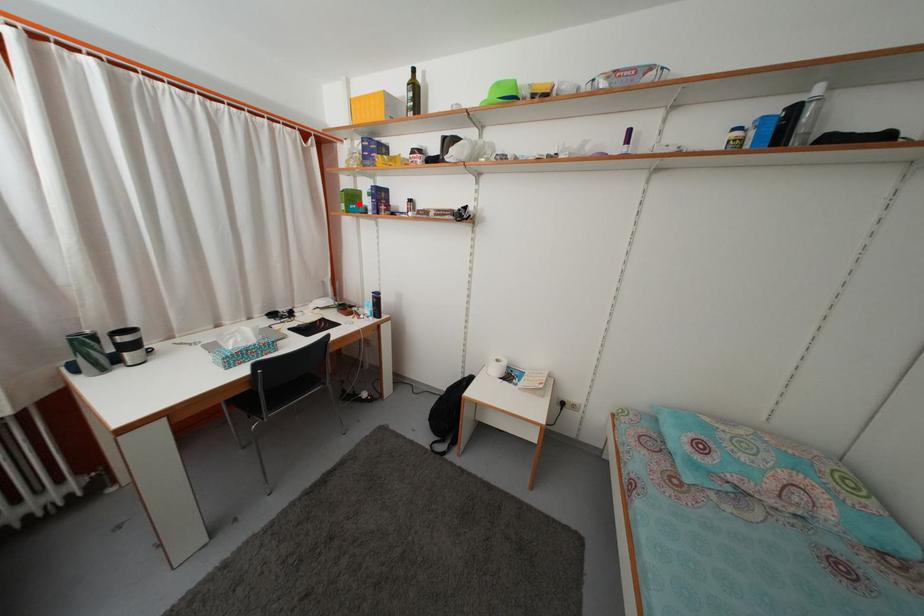
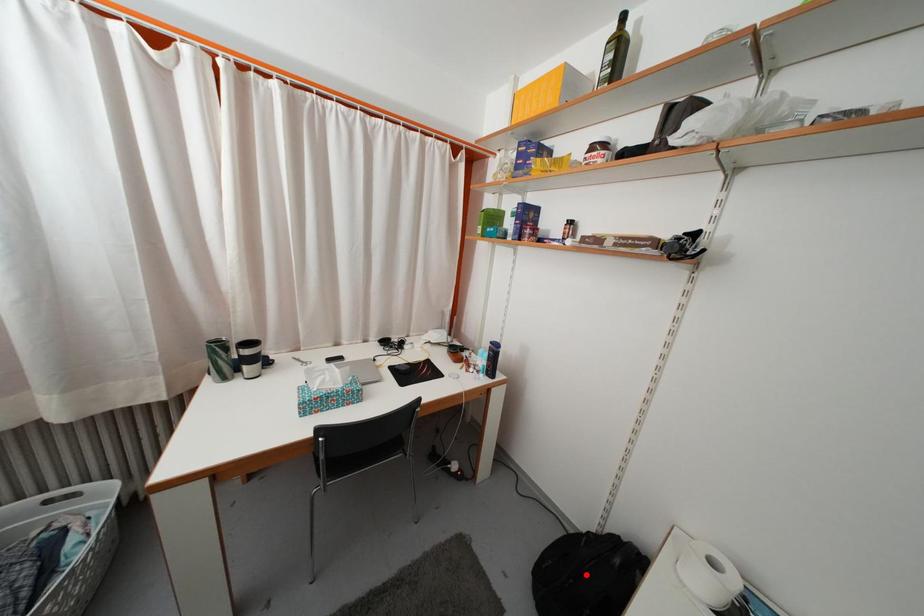
I am providing you with two images of the same scene from different viewpoints. A red point is marked on the first image and another point is marked on the second image. Does the point marked in image1 correspond to the same location as the one in image2?

No